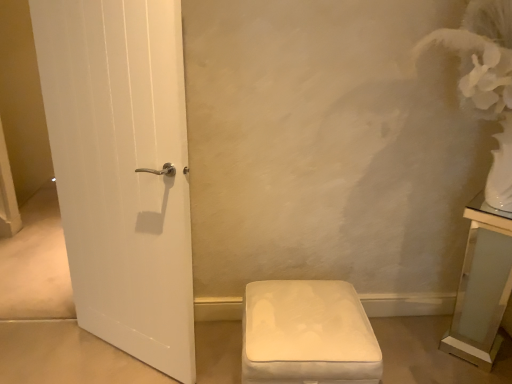
This screenshot has width=512, height=384. What are the coordinates of `white fabric ottoman at lower center` in the screenshot? It's located at (307, 334).

Describe the element at coordinates (307, 334) in the screenshot. I see `white fabric ottoman at lower center` at that location.

What is the approximate height of clear glass vanity at right?

clear glass vanity at right is 31.03 inches in height.

What do you see at coordinates (482, 286) in the screenshot?
I see `clear glass vanity at right` at bounding box center [482, 286].

Identify the location of clear glass vanity at right. (482, 286).

In order to click on white fabric ottoman at lower center in this screenshot , I will do `click(307, 334)`.

Between white fabric ottoman at lower center and clear glass vanity at right, which one appears on the right side from the viewer's perspective?

clear glass vanity at right.

Considering their positions, is white fabric ottoman at lower center located in front of or behind clear glass vanity at right?

white fabric ottoman at lower center is positioned closer to the viewer than clear glass vanity at right.

Considering the positions of point (255, 341) and point (494, 296), is point (255, 341) closer or farther from the camera than point (494, 296)?

Point (255, 341) is closer to the camera than point (494, 296).

From the image's perspective, is white fabric ottoman at lower center above clear glass vanity at right?

No, from the image's perspective, white fabric ottoman at lower center is not on top of clear glass vanity at right.

From a real-world perspective, between white fabric ottoman at lower center and clear glass vanity at right, who is vertically higher?

clear glass vanity at right, from a real-world perspective.

Which object is wider, white fabric ottoman at lower center or clear glass vanity at right?

white fabric ottoman at lower center is wider.

Who is taller, white fabric ottoman at lower center or clear glass vanity at right?

clear glass vanity at right is taller.

Considering the relative sizes of white fabric ottoman at lower center and clear glass vanity at right in the image provided, is white fabric ottoman at lower center smaller than clear glass vanity at right?

Incorrect, white fabric ottoman at lower center is not smaller in size than clear glass vanity at right.

Is white fabric ottoman at lower center spatially inside clear glass vanity at right, or outside of it?

white fabric ottoman at lower center is not enclosed by clear glass vanity at right.

Is white fabric ottoman at lower center far away from clear glass vanity at right?

No, white fabric ottoman at lower center is not far from clear glass vanity at right.

Is clear glass vanity at right at the back of white fabric ottoman at lower center?

No.

This screenshot has height=384, width=512. I want to click on vanity behind the white fabric ottoman at lower center, so click(x=482, y=286).

Considering the positions of objects clear glass vanity at right and white fabric ottoman at lower center in the image provided, who is more to the left, clear glass vanity at right or white fabric ottoman at lower center?

white fabric ottoman at lower center.

Which object is closer to the camera taking this photo, clear glass vanity at right or white fabric ottoman at lower center?

white fabric ottoman at lower center.

Considering the positions of points (490, 307) and (346, 341), is point (490, 307) closer to camera compared to point (346, 341)?

No, it is not.

From the image's perspective, relative to white fabric ottoman at lower center, is clear glass vanity at right above or below?

Based on their image positions, clear glass vanity at right is located above white fabric ottoman at lower center.

From a real-world perspective, between clear glass vanity at right and white fabric ottoman at lower center, who is vertically higher?

clear glass vanity at right is physically above.

Can you confirm if clear glass vanity at right is thinner than white fabric ottoman at lower center?

Yes, clear glass vanity at right is thinner than white fabric ottoman at lower center.

Considering the sizes of objects clear glass vanity at right and white fabric ottoman at lower center in the image provided, who is taller, clear glass vanity at right or white fabric ottoman at lower center?

clear glass vanity at right.

In the scene shown: Is clear glass vanity at right bigger or smaller than white fabric ottoman at lower center?

Considering their sizes, clear glass vanity at right takes up less space than white fabric ottoman at lower center.

Would you say clear glass vanity at right is inside or outside white fabric ottoman at lower center?

clear glass vanity at right lies outside white fabric ottoman at lower center.

Is clear glass vanity at right positioned far away from white fabric ottoman at lower center?

No, clear glass vanity at right is not far from white fabric ottoman at lower center.

From the picture: Is clear glass vanity at right positioned with its back to white fabric ottoman at lower center?

No.

How different are the orientations of clear glass vanity at right and white fabric ottoman at lower center in degrees?

44 degrees separate the facing orientations of clear glass vanity at right and white fabric ottoman at lower center.

Locate an element on the screen. vanity above the white fabric ottoman at lower center (from the image's perspective) is located at coordinates (482, 286).

What are the coordinates of `vanity behind the white fabric ottoman at lower center` in the screenshot? It's located at (482, 286).

Image resolution: width=512 pixels, height=384 pixels. In order to click on furniture beneath the clear glass vanity at right (from a real-world perspective) in this screenshot , I will do `click(307, 334)`.